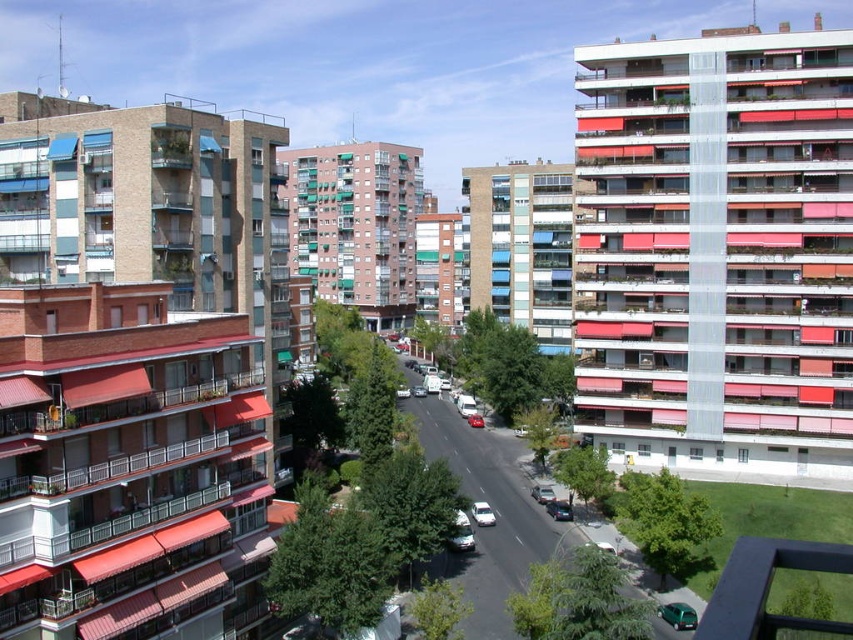
You are standing on the balcony overlooking the street and want to walk down to the metallic silver van at center and the metallic silver car at center. Which vehicle should you head towards first if you want to reach the one closer to your current position?

You should head towards the metallic silver van at center first because it is closer to your current position on the balcony compared to the metallic silver car at center, which is farther away.

You are standing on a balcony overlooking the street. You see two points marked on the scene. Which point is closer to you, point (436, 372) or point (567, 502)?

Point (436, 372) is further to the camera than point (567, 502), so the closer point is point (567, 502).